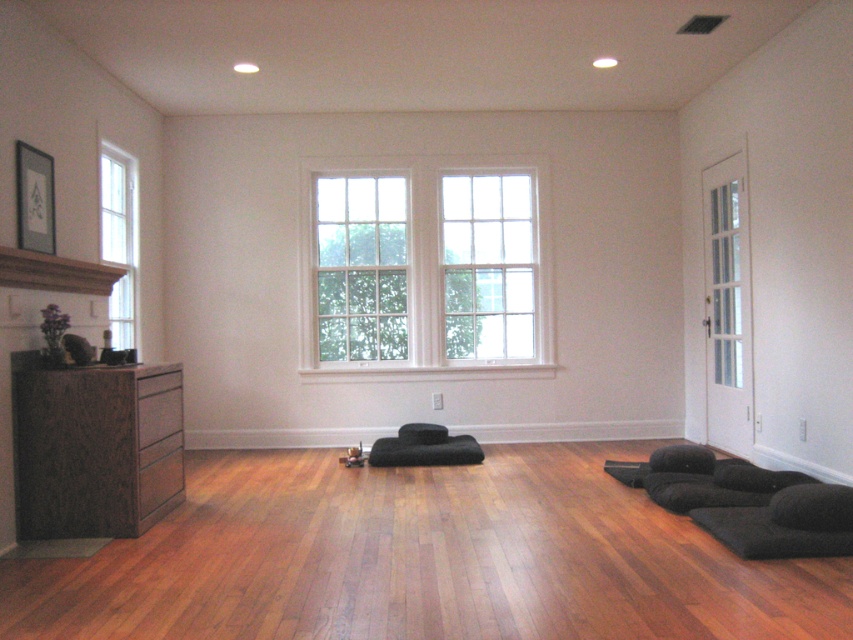
You are trying to place a new painting that is 1.2 meters wide between the dark wood dresser at left and the brown wood mantle at upper left. Based on their widths, can the painting fit horizontally between them?

The dark wood dresser at left might be wider than brown wood mantle at upper left, so the painting may or may not fit. You need to measure the space between them to confirm.

You are arranging furniture in the room and want to place a tall floor lamp between the dark wood dresser at left and the brown wood mantle at upper left. Can you position it directly in the middle between them?

The dark wood dresser at left is below the brown wood mantle at upper left, so positioning a tall floor lamp directly in the middle between them would be possible as they are vertically aligned.